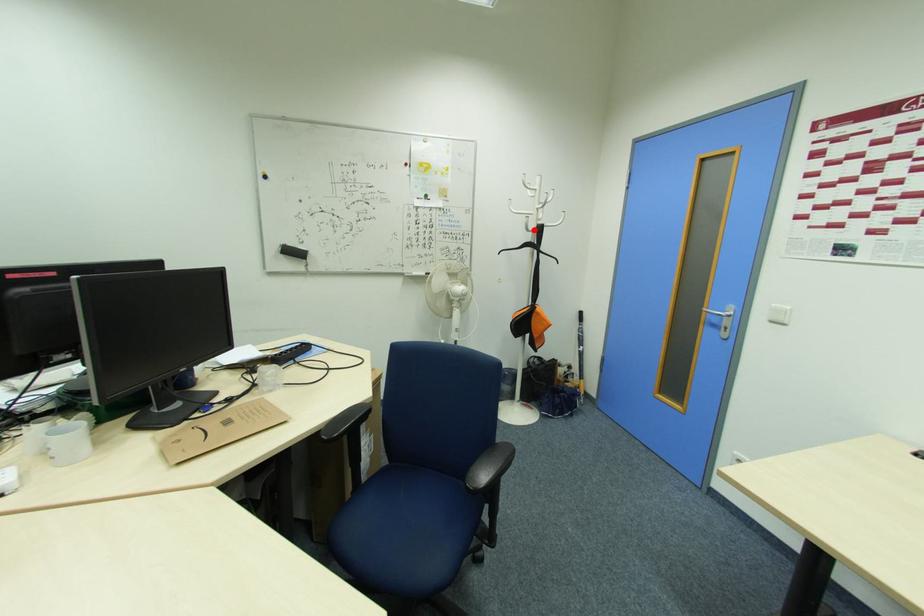
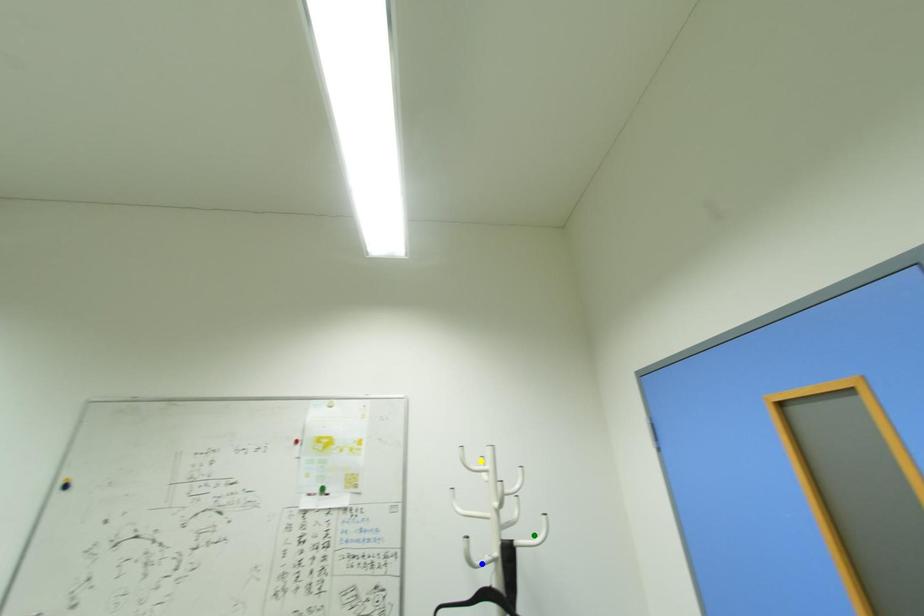
Question: I am providing you with two images of the same scene from different viewpoints. A red point is marked on the first image. You are given multiple points on the second image. Which spot in image 2 lines up with the point in image 1?

Choices:
 (A) blue point
 (B) yellow point
 (C) green point

Answer: (A)